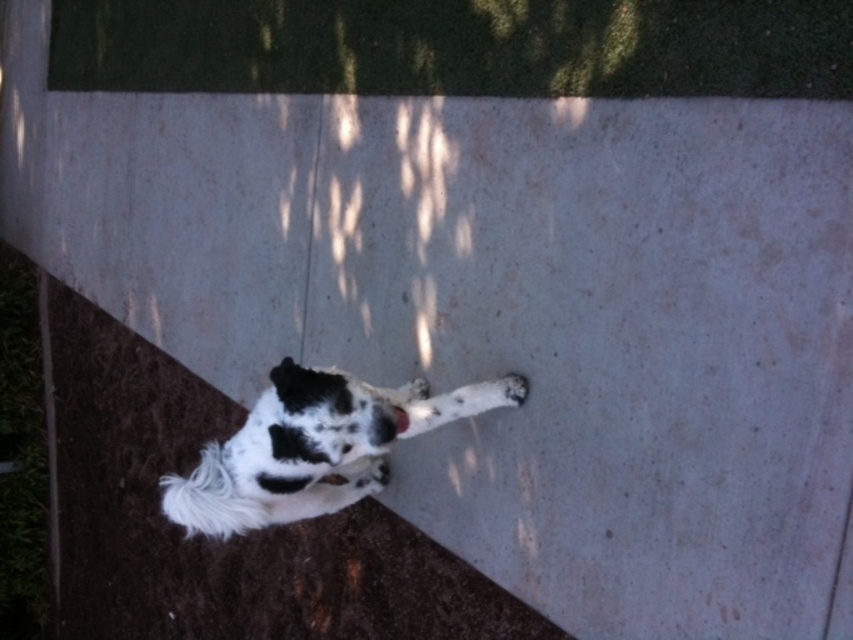
Can you confirm if white fur paw at center is shorter than white fur paw at lower right?

In fact, white fur paw at center may be taller than white fur paw at lower right.

Is point (374, 476) farther from camera compared to point (520, 381)?

Yes, point (374, 476) is farther from viewer.

Locate an element on the screen. The height and width of the screenshot is (640, 853). white fur paw at center is located at coordinates (370, 476).

Which is more to the right, white fur dog at lower left or white fur paw at center?

Positioned to the right is white fur paw at center.

Does white fur dog at lower left appear on the left side of white fur paw at center?

Yes, white fur dog at lower left is to the left of white fur paw at center.

Is point (259, 432) behind point (387, 460)?

No, it is in front of (387, 460).

The height and width of the screenshot is (640, 853). Identify the location of white fur dog at lower left. (308, 445).

Who is taller, white fur dog at lower left or white fur paw at lower right?

white fur dog at lower left

Identify the location of white fur dog at lower left. (308, 445).